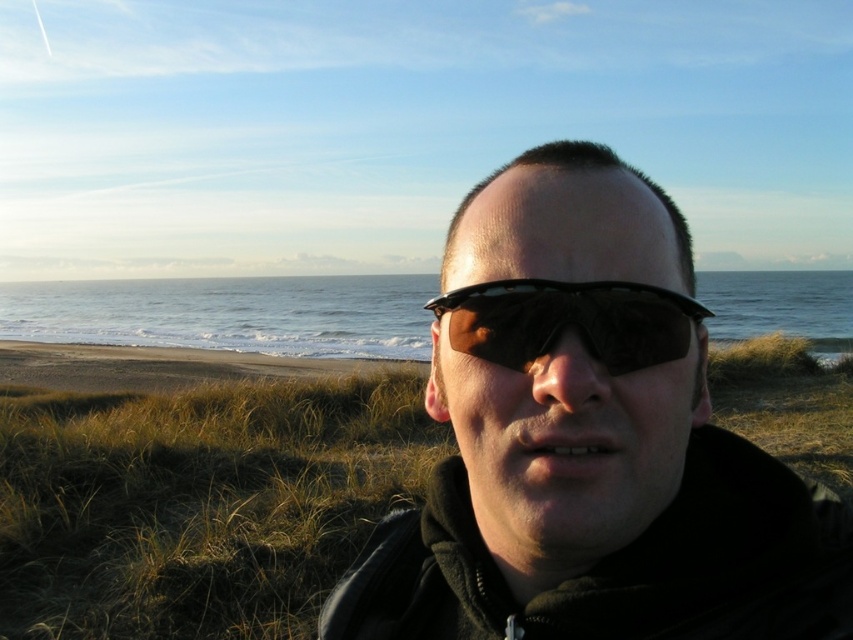
Which of these two, matte black sunglasses at center or clear blue water at center, stands shorter?

matte black sunglasses at center

Does matte black sunglasses at center have a larger size compared to clear blue water at center?

No, matte black sunglasses at center is not bigger than clear blue water at center.

Between point (503, 253) and point (341, 280), which one is positioned in front?

Point (503, 253)

I want to click on matte black sunglasses at center, so click(589, 449).

Consider the image. Who is more distant from viewer, (349, 458) or (503, 348)?

The point (349, 458) is more distant.

Is brown grass at lower center bigger than black reflective sunglasses at center?

Indeed, brown grass at lower center has a larger size compared to black reflective sunglasses at center.

Locate an element on the screen. This screenshot has height=640, width=853. brown grass at lower center is located at coordinates (198, 502).

How much distance is there between brown grass at lower center and clear blue water at center?

brown grass at lower center is 141.57 feet from clear blue water at center.

Who is more distant from viewer, (213,504) or (234,301)?

The point (234,301) is behind.

Between point (155, 582) and point (80, 291), which one is positioned in front?

Positioned in front is point (155, 582).

The width and height of the screenshot is (853, 640). I want to click on brown grass at lower center, so click(x=198, y=502).